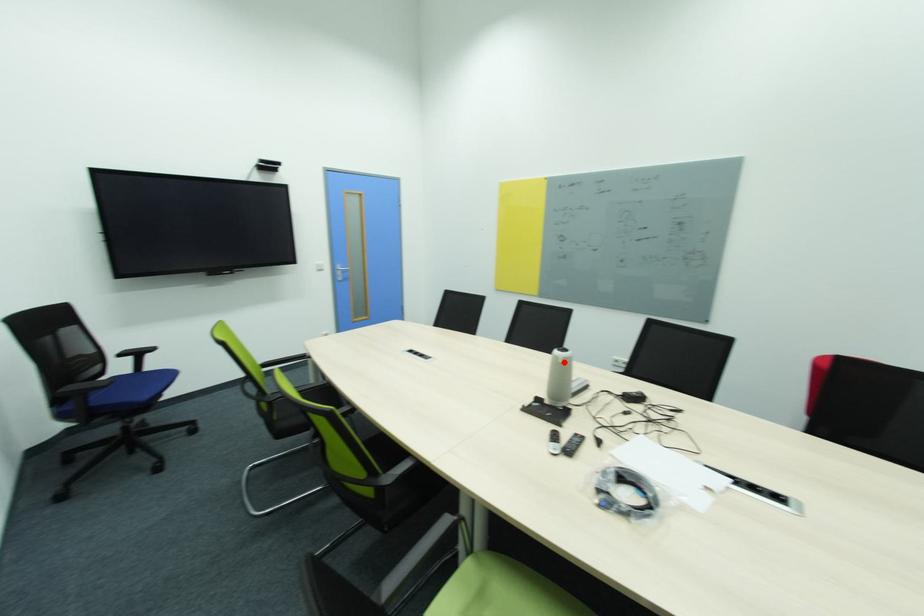
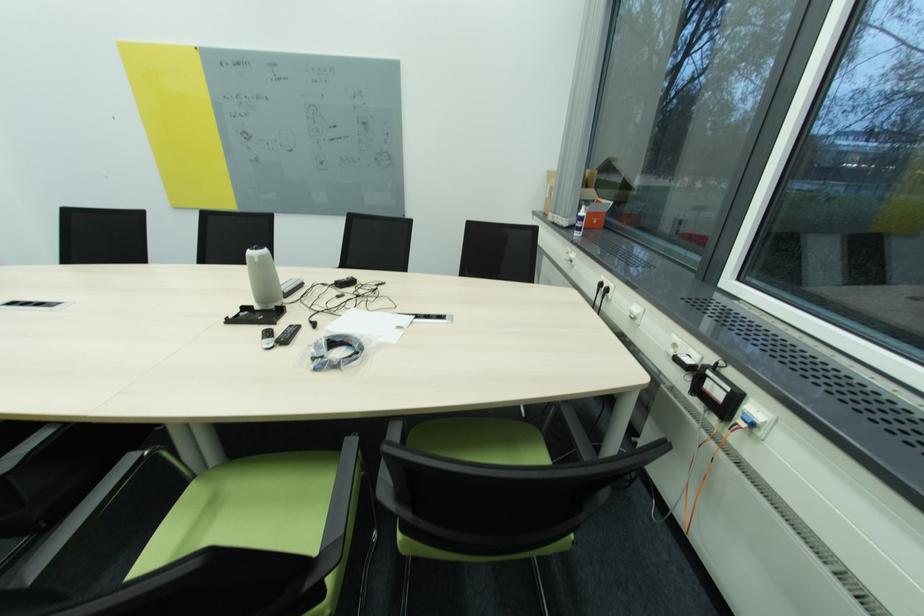
Question: I am providing you with two images of the same scene from different viewpoints. A red point is marked on the first image. Can you still see the location of the red point in image 2?

Choices:
 (A) Yes
 (B) No

Answer: (A)